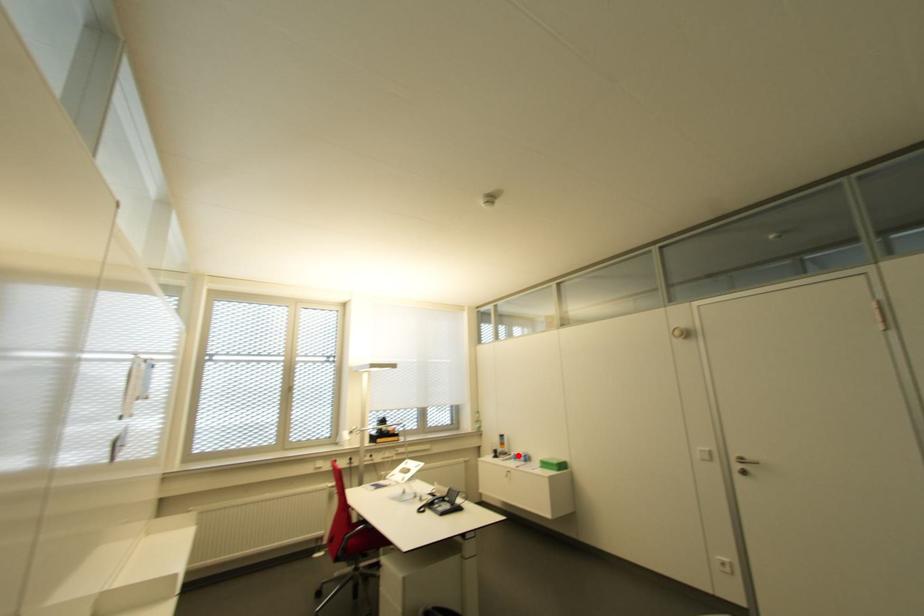
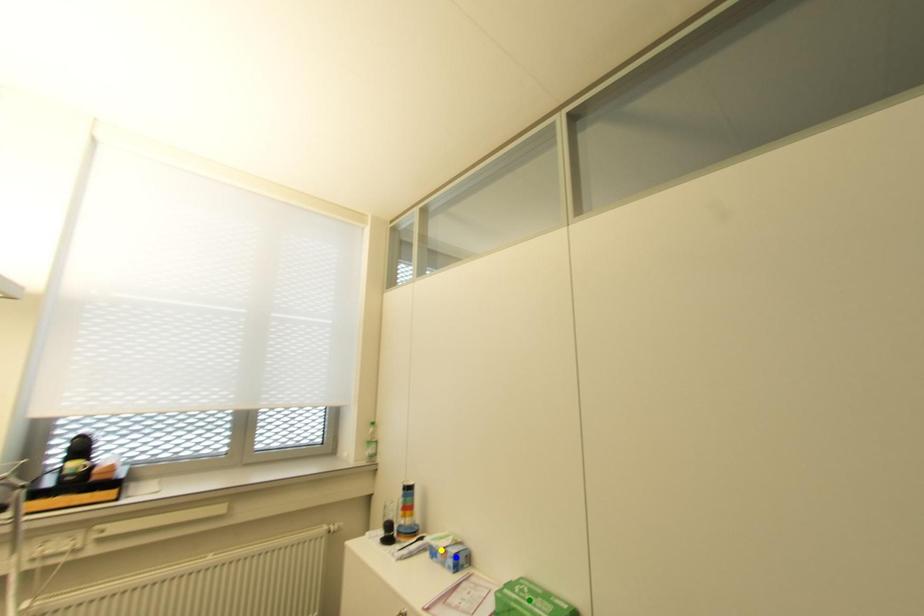
Question: I am providing you with two images of the same scene from different viewpoints. A red point is marked on the first image. You are given multiple points on the second image. Which point in image 2 represents the same 3d spot as the red point in image 1?

Choices:
 (A) blue point
 (B) green point
 (C) yellow point

Answer: (C)